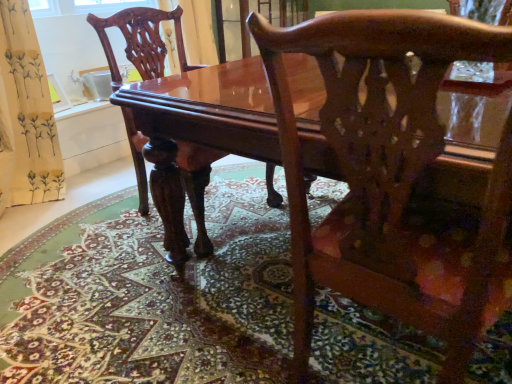
This screenshot has height=384, width=512. What are the coordinates of `blank space above carpeted floor at center (from a real-world perspective)` in the screenshot? It's located at (163, 285).